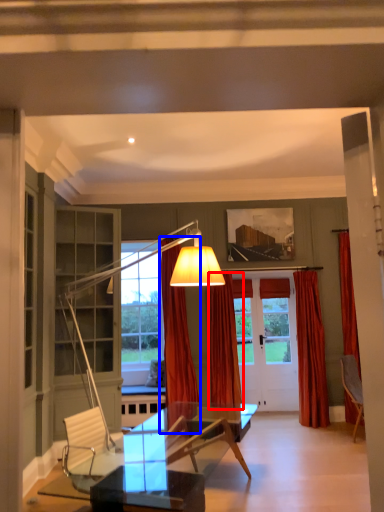
Question: Which object is further to the camera taking this photo, curtain (highlighted by a red box) or curtain (highlighted by a blue box)?

Choices:
 (A) curtain
 (B) curtain

Answer: (A)